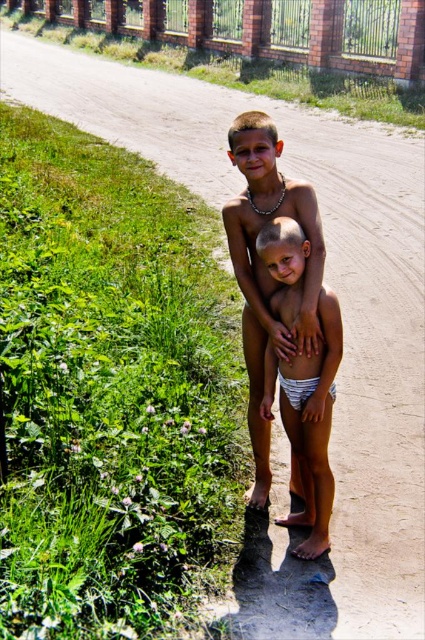
You are standing at the origin point of the coordinate system. You want to walk to the brick wall at upper center. What direction should you walk in?

Since the brick wall at upper center is located at coordinate point (x=265, y=29), you should walk towards the upper center direction to reach it.

From the picture: You are a photographer trying to capture the two boys in the scene. To ensure the brick wall at upper center is not in the frame, where should you position your camera relative to the boys?

To avoid including the brick wall at upper center in the frame, position the camera below the boys since the brick wall at upper center is located at point (x=265, y=29), which is higher up in the image.

You are a photographer trying to capture a photo of the white striped underwear at center without including the brick wall at upper center in the frame. Is this possible based on their positions?

The brick wall at upper center is further to the viewer than the white striped underwear at center, so it is closer to the camera. This means the wall would block the view of the underwear, making it impossible to capture the underwear without the wall in the frame.